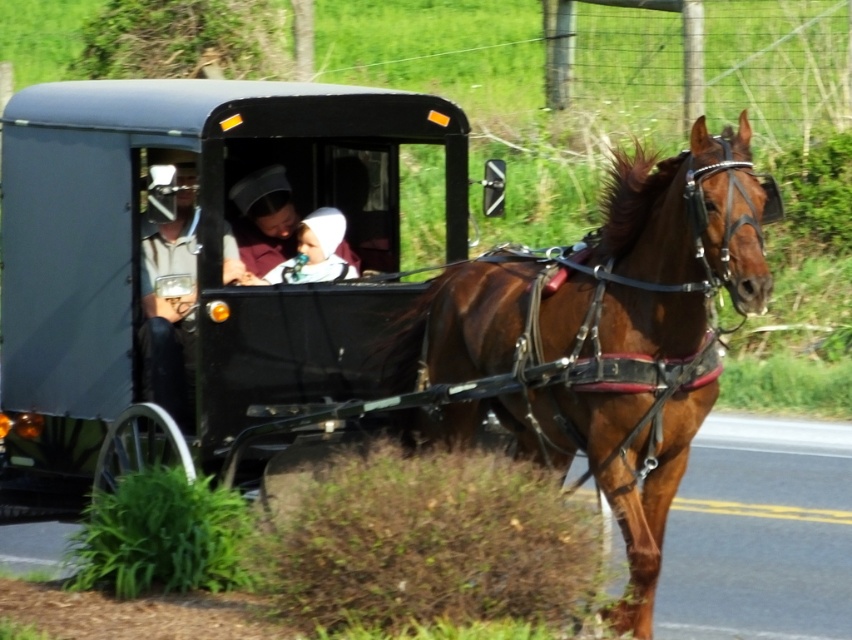
Question: Is light brown leather jacket at center further to camera compared to white cloth at center?

Choices:
 (A) no
 (B) yes

Answer: (A)

Question: Which object is positioned farthest from the brown glossy harness at center?

Choices:
 (A) light brown leather jacket at center
 (B) white cloth at center

Answer: (B)

Question: Which is nearer to the white cloth at center?

Choices:
 (A) brown glossy harness at center
 (B) light brown leather jacket at center

Answer: (B)

Question: Is light brown leather jacket at center above white cloth at center?

Choices:
 (A) no
 (B) yes

Answer: (A)

Question: Which object is the farthest from the white cloth at center?

Choices:
 (A) light brown leather jacket at center
 (B) matte brown dress at center
 (C) brown glossy harness at center

Answer: (C)

Question: Is brown glossy harness at center bigger than matte brown dress at center?

Choices:
 (A) no
 (B) yes

Answer: (B)